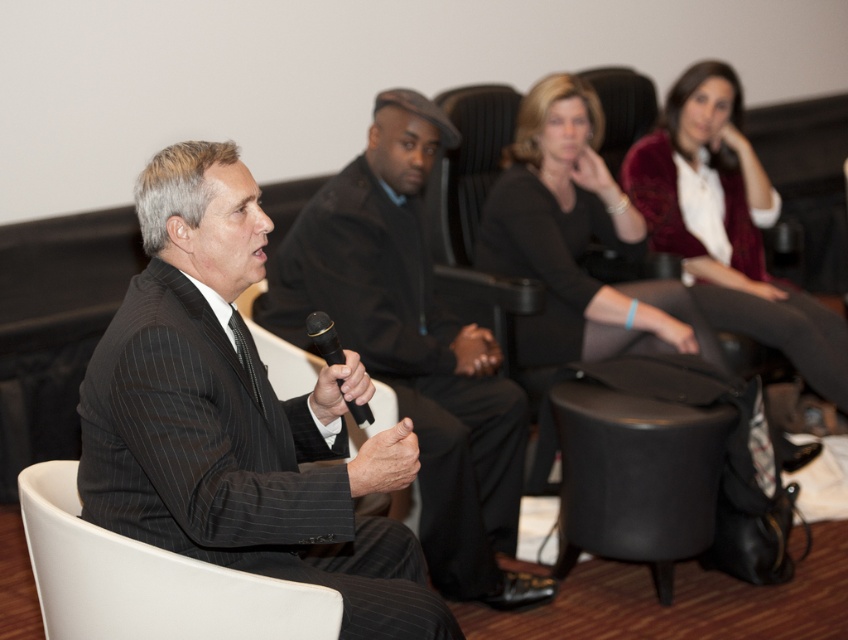
Question: Which of these objects is positioned closest to the black plastic microphone at center?

Choices:
 (A) white leather chair at center
 (B) velvet maroon sweater at upper right
 (C) matte black suit at center
 (D) dark gray pinstripe suit at center

Answer: (C)

Question: Estimate the real-world distances between objects in this image. Which object is closer to the velvet maroon sweater at upper right?

Choices:
 (A) white leather chair at center
 (B) black leather stool at lower center

Answer: (B)

Question: Does matte black suit at center come behind velvet maroon sweater at upper right?

Choices:
 (A) yes
 (B) no

Answer: (B)

Question: Which of the following is the farthest from the observer?

Choices:
 (A) (49, 589)
 (B) (322, 353)
 (C) (411, 186)

Answer: (C)

Question: Can you confirm if dark gray pinstripe suit at center is thinner than white plastic chair at lower left?

Choices:
 (A) yes
 (B) no

Answer: (B)

Question: Can you confirm if matte black suit at center is thinner than dark gray pinstripe suit at center?

Choices:
 (A) no
 (B) yes

Answer: (B)